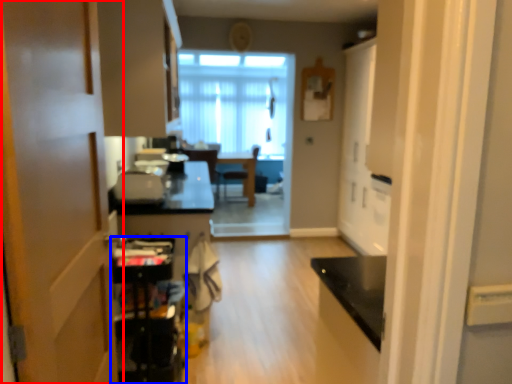
Question: Which object appears farthest to the camera in this image, door (highlighted by a red box) or appliance (highlighted by a blue box)?

Choices:
 (A) door
 (B) appliance

Answer: (B)